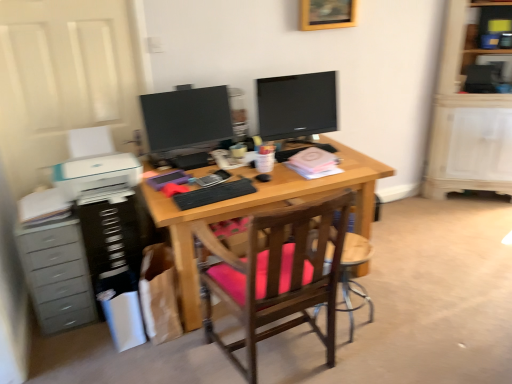
Question: Is black plastic dresser at left with wooden chair with pink cushion at center?

Choices:
 (A) yes
 (B) no

Answer: (B)

Question: Can you confirm if black plastic dresser at left is smaller than wooden chair with pink cushion at center?

Choices:
 (A) yes
 (B) no

Answer: (A)

Question: Can you confirm if black plastic dresser at left is positioned to the right of wooden chair with pink cushion at center?

Choices:
 (A) no
 (B) yes

Answer: (A)

Question: Is black plastic dresser at left shorter than wooden chair with pink cushion at center?

Choices:
 (A) no
 (B) yes

Answer: (B)

Question: Considering the relative sizes of black plastic dresser at left and wooden chair with pink cushion at center in the image provided, is black plastic dresser at left taller than wooden chair with pink cushion at center?

Choices:
 (A) yes
 (B) no

Answer: (B)

Question: Does black plastic dresser at left have a larger size compared to wooden chair with pink cushion at center?

Choices:
 (A) no
 (B) yes

Answer: (A)

Question: Is wooden shelf at upper right placed right next to wooden chair with pink cushion at center?

Choices:
 (A) yes
 (B) no

Answer: (B)

Question: Is wooden shelf at upper right further to camera compared to wooden chair with pink cushion at center?

Choices:
 (A) no
 (B) yes

Answer: (B)

Question: Can you confirm if wooden shelf at upper right is taller than wooden chair with pink cushion at center?

Choices:
 (A) yes
 (B) no

Answer: (B)

Question: Is wooden shelf at upper right thinner than wooden chair with pink cushion at center?

Choices:
 (A) no
 (B) yes

Answer: (B)

Question: From a real-world perspective, is wooden shelf at upper right physically above wooden chair with pink cushion at center?

Choices:
 (A) no
 (B) yes

Answer: (B)

Question: Does wooden shelf at upper right have a larger size compared to wooden chair with pink cushion at center?

Choices:
 (A) yes
 (B) no

Answer: (B)

Question: Does wooden chair at center appear on the right side of matte black monitor at center, arranged as the 1th television when viewed from the left?

Choices:
 (A) yes
 (B) no

Answer: (A)